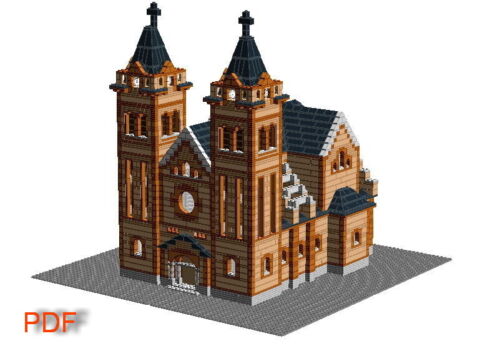
Locate an element on the screen. window is located at coordinates (265, 266), (272, 139), (186, 169), (144, 199), (138, 246).